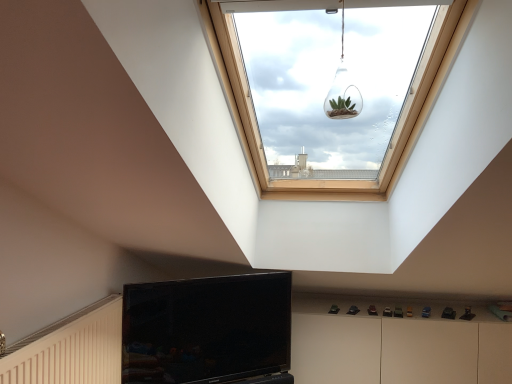
What do you see at coordinates (396, 342) in the screenshot? This screenshot has width=512, height=384. I see `white glossy dresser at lower right` at bounding box center [396, 342].

Describe the element at coordinates (343, 89) in the screenshot. I see `clear glass terrarium at upper center` at that location.

Measure the distance between point (199, 299) and camera.

A distance of 2.27 meters exists between point (199, 299) and camera.

This screenshot has width=512, height=384. I want to click on white glossy dresser at lower right, so click(396, 342).

Which object is further away from the camera, white glossy dresser at lower right or black glossy tv at lower center?

white glossy dresser at lower right is more distant.

Measure the distance between white glossy dresser at lower right and black glossy tv at lower center.

→ white glossy dresser at lower right is 30.31 inches away from black glossy tv at lower center.

From the image's perspective, is white glossy dresser at lower right above or below black glossy tv at lower center?

Based on their image positions, white glossy dresser at lower right is located beneath black glossy tv at lower center.

Based on the photo, from a real-world perspective, is white glossy dresser at lower right over black glossy tv at lower center?

No, from a real-world perspective, white glossy dresser at lower right is not above black glossy tv at lower center.

From the image's perspective, does clear glass terrarium at upper center appear lower than white glossy dresser at lower right?

No, from the image's perspective, clear glass terrarium at upper center is not below white glossy dresser at lower right.

Is there a large distance between clear glass terrarium at upper center and white glossy dresser at lower right?

That's right, there is a large distance between clear glass terrarium at upper center and white glossy dresser at lower right.

From a real-world perspective, which object stands above the other?

clear glass terrarium at upper center.

The image size is (512, 384). What are the coordinates of `television that is under the clear glass terrarium at upper center (from a real-world perspective)` in the screenshot? It's located at (208, 331).

Is clear glass terrarium at upper center positioned with its back to black glossy tv at lower center?

clear glass terrarium at upper center does not have its back to black glossy tv at lower center.

Considering the relative positions of clear glass terrarium at upper center and black glossy tv at lower center in the image provided, is clear glass terrarium at upper center to the left of black glossy tv at lower center from the viewer's perspective?

Incorrect, clear glass terrarium at upper center is not on the left side of black glossy tv at lower center.

From the image's perspective, which one is positioned lower, white glossy dresser at lower right or clear glass terrarium at upper center?

From the image's view, white glossy dresser at lower right is below.

Between point (348, 365) and point (325, 108), which one is positioned in front?

Positioned in front is point (348, 365).

From a real-world perspective, is white glossy dresser at lower right physically above clear glass terrarium at upper center?

No.

Is clear glass terrarium at upper center completely or partially inside white glossy dresser at lower right?

No, white glossy dresser at lower right does not contain clear glass terrarium at upper center.

How different are the orientations of black glossy tv at lower center and white glossy dresser at lower right in degrees?

There is a 32.4-degree angle between the facing directions of black glossy tv at lower center and white glossy dresser at lower right.

Is black glossy tv at lower center looking in the opposite direction of white glossy dresser at lower right?

No.

Identify the location of television that appears above the white glossy dresser at lower right (from a real-world perspective). click(x=208, y=331).

Which point is more forward, (x=139, y=376) or (x=485, y=348)?

Point (x=139, y=376)

Is point (179, 366) behind point (352, 110)?

Yes, it is behind point (352, 110).

Which of these two, black glossy tv at lower center or clear glass terrarium at upper center, stands shorter?

clear glass terrarium at upper center is shorter.

Is black glossy tv at lower center placed right next to clear glass terrarium at upper center?

There is a gap between black glossy tv at lower center and clear glass terrarium at upper center.

Would you say black glossy tv at lower center is inside or outside clear glass terrarium at upper center?

black glossy tv at lower center lies outside clear glass terrarium at upper center.

Identify the location of dresser to the right of black glossy tv at lower center. (396, 342).

Locate an element on the screen. This screenshot has height=384, width=512. dresser that is below the clear glass terrarium at upper center (from the image's perspective) is located at coordinates (396, 342).

Consider the image. When comparing their distances from clear glass terrarium at upper center, does white glossy dresser at lower right or black glossy tv at lower center seem further?

white glossy dresser at lower right lies further to clear glass terrarium at upper center than the other object.

Considering their positions, is white glossy dresser at lower right positioned further to black glossy tv at lower center than clear glass terrarium at upper center?

The object further to black glossy tv at lower center is clear glass terrarium at upper center.

Looking at the image, which one is located further to black glossy tv at lower center, clear glass terrarium at upper center or white glossy dresser at lower right?

The object further to black glossy tv at lower center is clear glass terrarium at upper center.

Looking at the image, which one is located further to clear glass terrarium at upper center, black glossy tv at lower center or white glossy dresser at lower right?

The object further to clear glass terrarium at upper center is white glossy dresser at lower right.

Considering their positions, is black glossy tv at lower center positioned further to white glossy dresser at lower right than clear glass terrarium at upper center?

clear glass terrarium at upper center is further to white glossy dresser at lower right.

Looking at the image, which one is located further to white glossy dresser at lower right, clear glass terrarium at upper center or black glossy tv at lower center?

clear glass terrarium at upper center lies further to white glossy dresser at lower right than the other object.

Image resolution: width=512 pixels, height=384 pixels. Identify the location of television between clear glass terrarium at upper center and white glossy dresser at lower right from front to back. (208, 331).